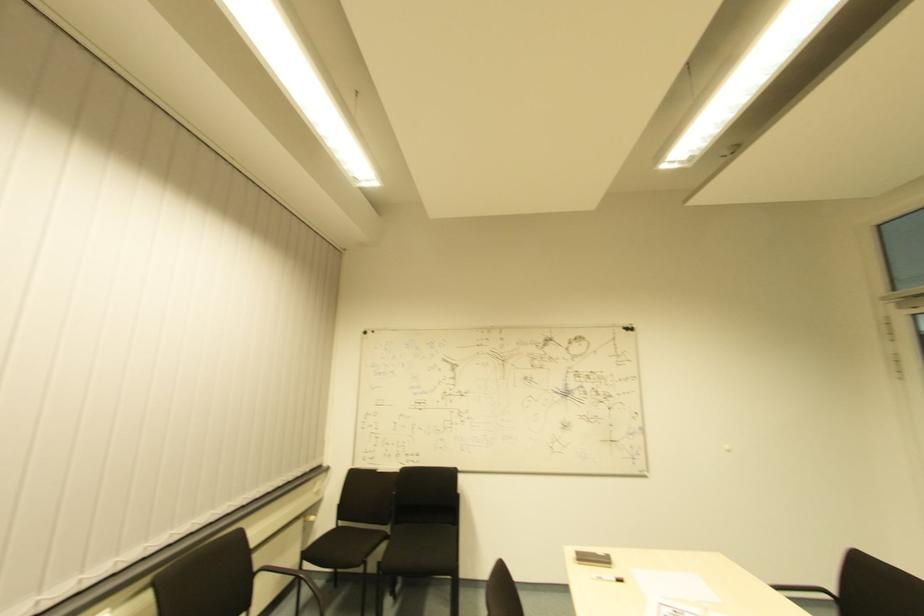
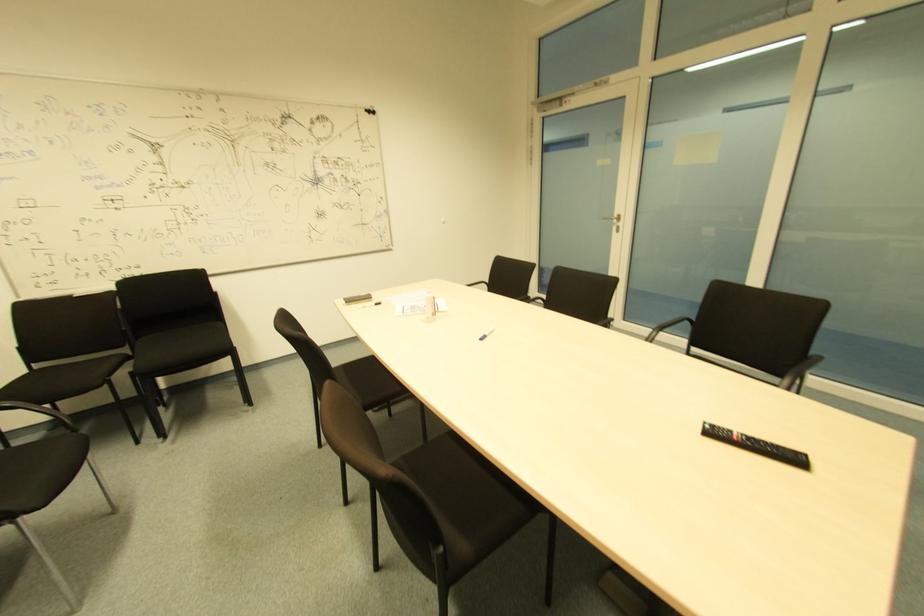
In the second image, find the point that corresponds to the point at 606,565 in the first image.

(365, 301)